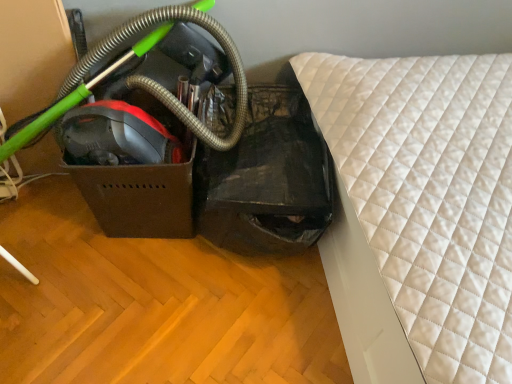
The width and height of the screenshot is (512, 384). What are the coordinates of `vacant space in front of green rubber garden hose at left` in the screenshot? It's located at (101, 300).